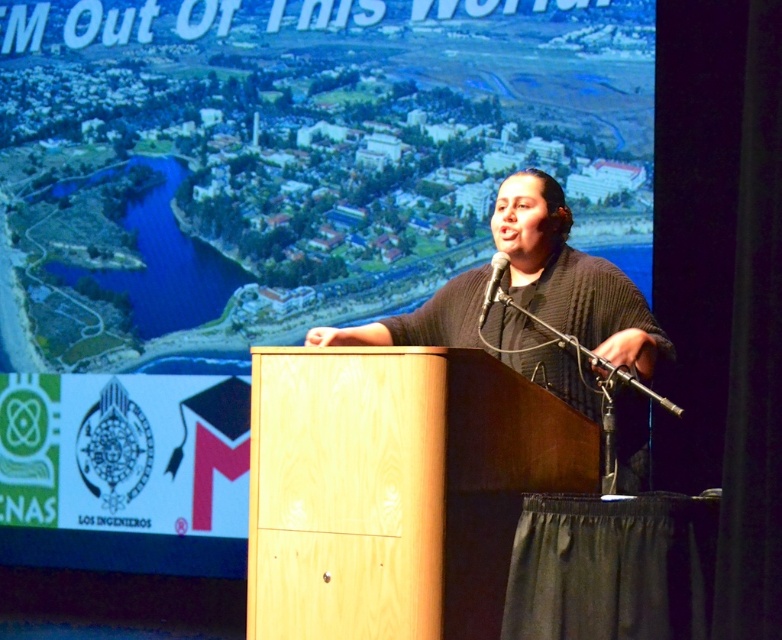
This screenshot has width=782, height=640. What do you see at coordinates (395, 488) in the screenshot?
I see `light wood podium at center` at bounding box center [395, 488].

Between light wood podium at center and black knitted sweater at center, which one has more height?

black knitted sweater at center

This screenshot has height=640, width=782. What do you see at coordinates (395, 488) in the screenshot?
I see `light wood podium at center` at bounding box center [395, 488].

What are the coordinates of `light wood podium at center` in the screenshot? It's located at (395, 488).

Is light wood podium at center bigger than black matte microphone at center?

Indeed, light wood podium at center has a larger size compared to black matte microphone at center.

Between light wood podium at center and black matte microphone at center, which one appears on the left side from the viewer's perspective?

From the viewer's perspective, light wood podium at center appears more on the left side.

Between point (318, 612) and point (501, 260), which one is positioned in front?

Point (318, 612)

You are a GUI agent. You are given a task and a screenshot of the screen. Output one action in this format:
    pyautogui.click(x=<x>, y=<y>)
    Task: Click on the light wood podium at center
    
    Given the screenshot: What is the action you would take?
    pyautogui.click(x=395, y=488)

Is black knitted sweater at center further to camera compared to black matte microphone at center?

No, it is not.

Is black knitted sweater at center to the right of black matte microphone at center from the viewer's perspective?

Indeed, black knitted sweater at center is positioned on the right side of black matte microphone at center.

The width and height of the screenshot is (782, 640). Describe the element at coordinates (571, 276) in the screenshot. I see `black knitted sweater at center` at that location.

The height and width of the screenshot is (640, 782). In order to click on black knitted sweater at center in this screenshot , I will do click(x=571, y=276).